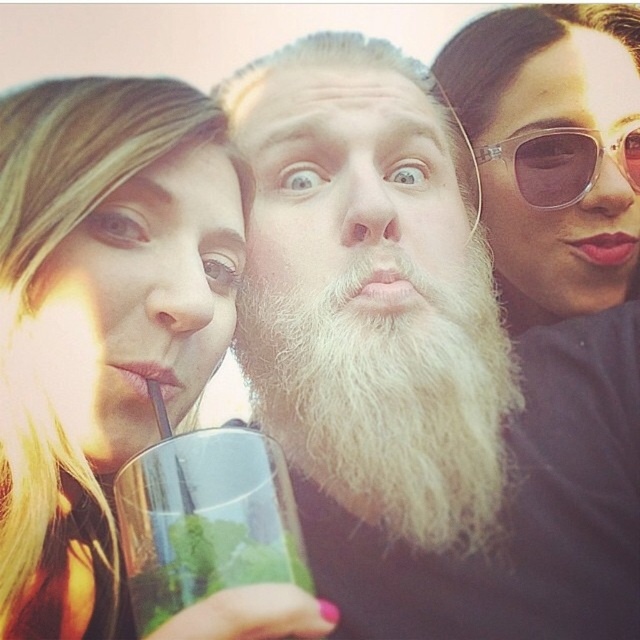
You are a photographer trying to capture a close detail shot of the sunglasses at upper right and the blonde hair at left. Given their sizes, which object should you focus on first to ensure it fits within your camera frame?

The sunglasses at upper right should be focused on first because the blonde hair at left is larger in size than the sunglasses at upper right, so adjusting the frame for the smaller object first ensures proper composition.